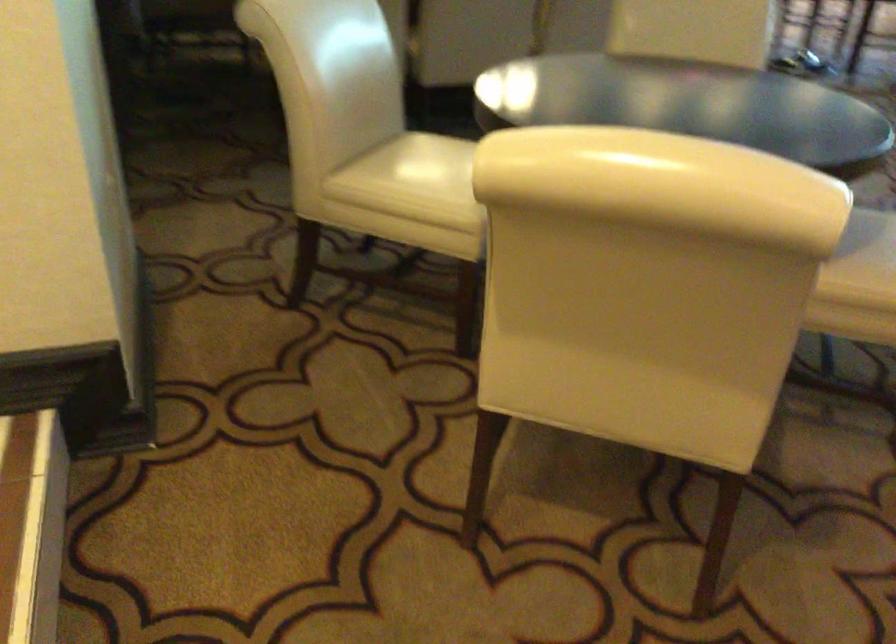
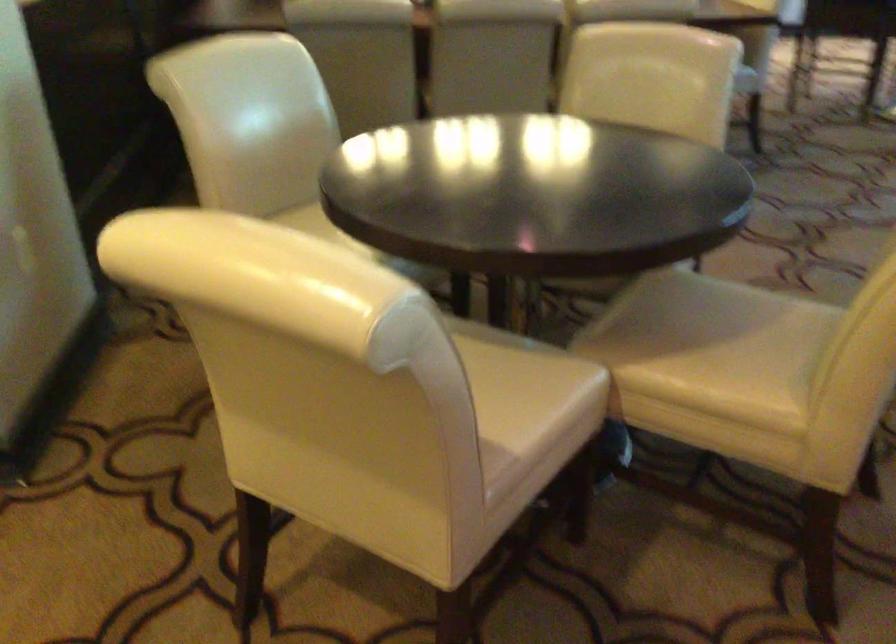
In the second image, find the point that corresponds to point (394, 158) in the first image.

(306, 220)